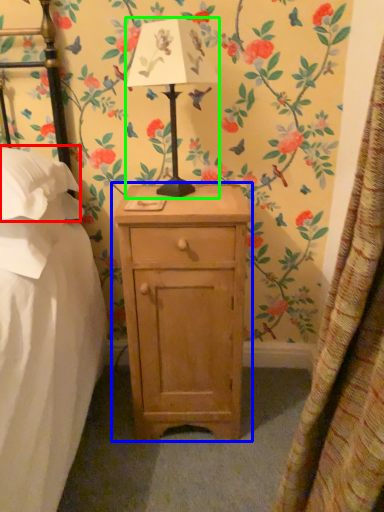
Question: Which object is the farthest from pillow (highlighted by a red box)? Choose among these: nightstand (highlighted by a blue box) or table lamp (highlighted by a green box).

Choices:
 (A) nightstand
 (B) table lamp

Answer: (A)